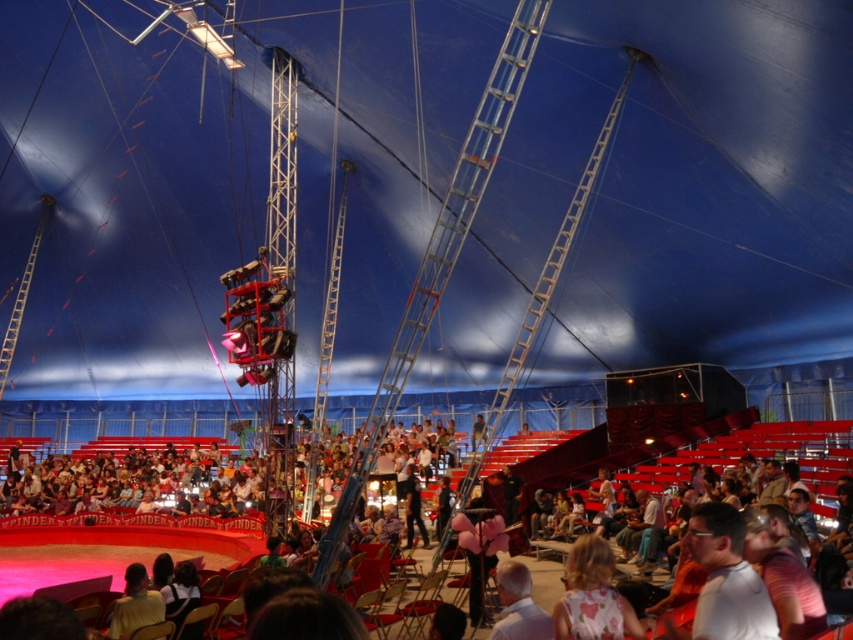
Can you confirm if floral fabric dress at center is positioned to the right of white matte shirt at lower center?

Indeed, floral fabric dress at center is positioned on the right side of white matte shirt at lower center.

Can you confirm if floral fabric dress at center is positioned below white matte shirt at lower center?

No, floral fabric dress at center is not below white matte shirt at lower center.

I want to click on floral fabric dress at center, so click(592, 596).

At what (x,y) coordinates should I click in order to perform the action: click on floral fabric dress at center. Please return your answer as a coordinate pair (x, y). The width and height of the screenshot is (853, 640). Looking at the image, I should click on (592, 596).

Does floral fabric dress at center have a smaller size compared to light brown hair at lower center?

Correct, floral fabric dress at center occupies less space than light brown hair at lower center.

Is point (585, 572) less distant than point (144, 604)?

Yes.

The width and height of the screenshot is (853, 640). I want to click on floral fabric dress at center, so click(592, 596).

Is point (532, 632) farther from camera compared to point (119, 636)?

No, (532, 632) is in front of (119, 636).

Does white matte shirt at lower center have a greater width compared to light brown hair at lower center?

No, white matte shirt at lower center is not wider than light brown hair at lower center.

Does point (500, 620) lie behind point (122, 611)?

No, it is in front of (122, 611).

This screenshot has height=640, width=853. In order to click on white matte shirt at lower center in this screenshot , I will do `click(518, 605)`.